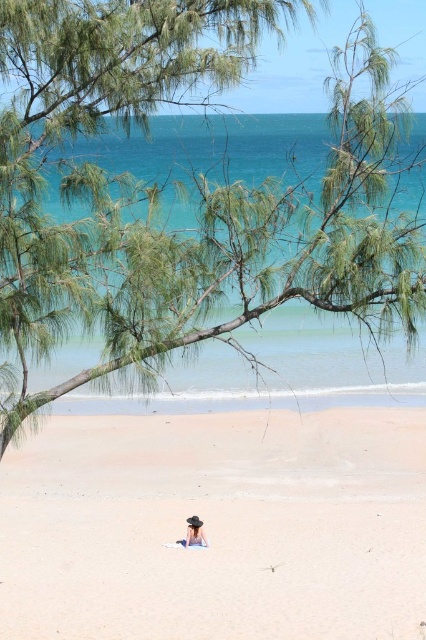
In the scene shown: You are standing at the camera position and want to throw a ball to both points on the beach. Which point, point (259, 36) or point (210, 531), is closer to you?

Point (259, 36) is closer to the camera than point (210, 531).